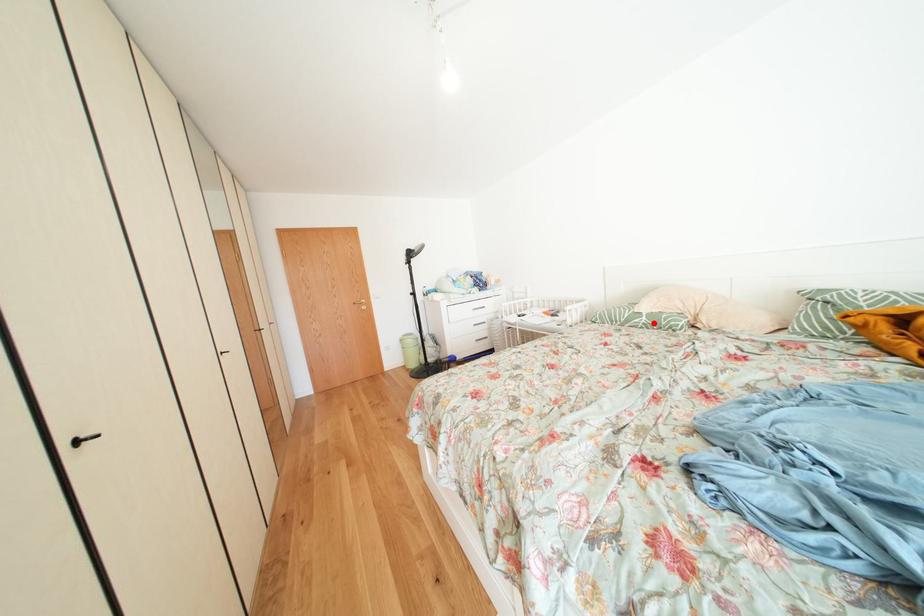
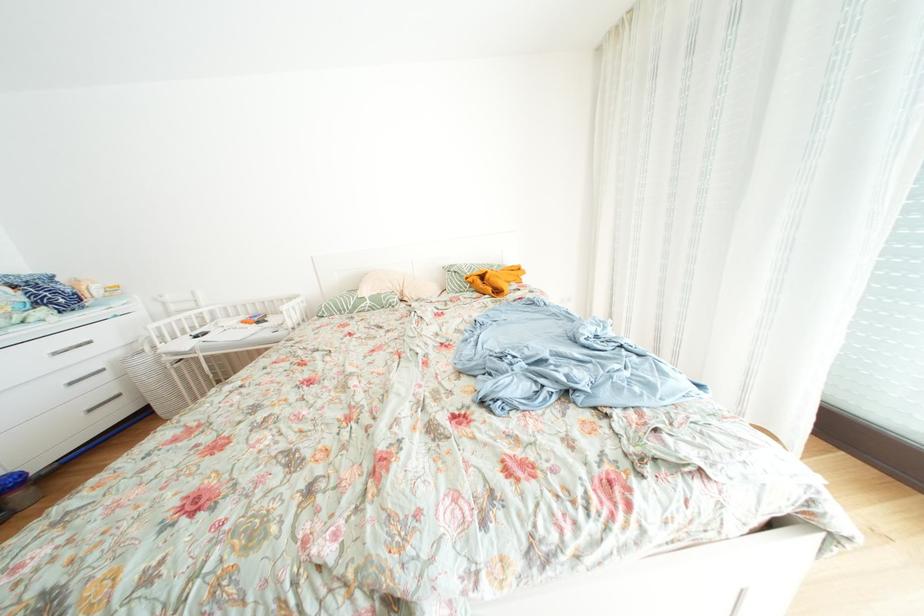
Locate, in the second image, the point that corresponds to the highlighted location in the first image.

(378, 307)